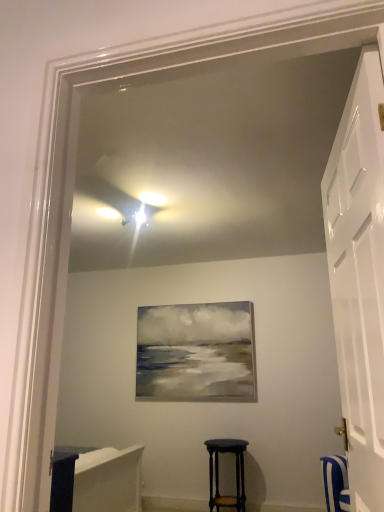
Question: Considering the positions of white glossy door at right and dark wood stool at center in the image, is white glossy door at right bigger or smaller than dark wood stool at center?

Choices:
 (A) small
 (B) big

Answer: (B)

Question: Considering the positions of white glossy door at right and dark wood stool at center in the image, is white glossy door at right wider or thinner than dark wood stool at center?

Choices:
 (A) wide
 (B) thin

Answer: (B)

Question: From the image's perspective, is white glossy door at right above or below dark wood stool at center?

Choices:
 (A) below
 (B) above

Answer: (B)

Question: Relative to white glossy door at right, is dark wood stool at center in front or behind?

Choices:
 (A) front
 (B) behind

Answer: (B)

Question: Considering the positions of dark wood stool at center and white glossy door at right in the image, is dark wood stool at center taller or shorter than white glossy door at right?

Choices:
 (A) tall
 (B) short

Answer: (B)

Question: From the image's perspective, is dark wood stool at center above or below white glossy door at right?

Choices:
 (A) below
 (B) above

Answer: (A)

Question: From a real-world perspective, is dark wood stool at center positioned above or below white glossy door at right?

Choices:
 (A) above
 (B) below

Answer: (B)